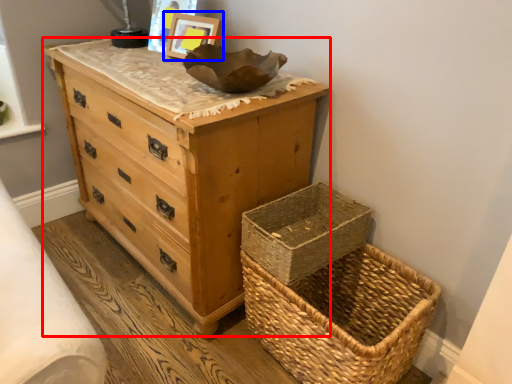
Question: Which point is closer to the camera, chest of drawers (highlighted by a red box) or picture frame (highlighted by a blue box)?

Choices:
 (A) chest of drawers
 (B) picture frame

Answer: (A)